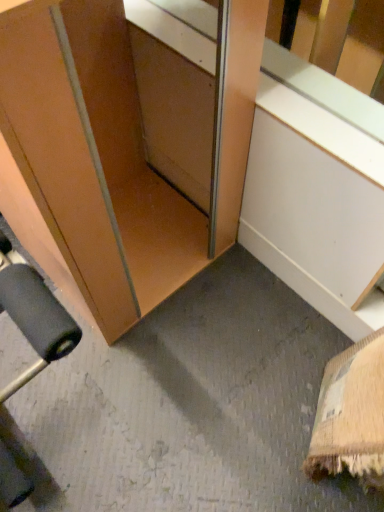
Question: Is matte wood cabinet at lower left shorter than wooden at lower left?

Choices:
 (A) yes
 (B) no

Answer: (B)

Question: Is wooden at lower left surrounded by matte wood cabinet at lower left?

Choices:
 (A) no
 (B) yes

Answer: (A)

Question: Are matte wood cabinet at lower left and wooden at lower left beside each other?

Choices:
 (A) yes
 (B) no

Answer: (B)

Question: From the image's perspective, does matte wood cabinet at lower left appear lower than wooden at lower left?

Choices:
 (A) yes
 (B) no

Answer: (B)

Question: Is matte wood cabinet at lower left at the left side of wooden at lower left?

Choices:
 (A) yes
 (B) no

Answer: (A)

Question: Could you tell me if matte wood cabinet at lower left is turned towards wooden at lower left?

Choices:
 (A) yes
 (B) no

Answer: (B)

Question: Considering the relative sizes of wooden at lower left and matte wood cabinet at lower left in the image provided, is wooden at lower left thinner than matte wood cabinet at lower left?

Choices:
 (A) no
 (B) yes

Answer: (B)

Question: Does wooden at lower left come behind matte wood cabinet at lower left?

Choices:
 (A) no
 (B) yes

Answer: (B)

Question: Considering the relative sizes of wooden at lower left and matte wood cabinet at lower left in the image provided, is wooden at lower left bigger than matte wood cabinet at lower left?

Choices:
 (A) yes
 (B) no

Answer: (B)

Question: Can we say wooden at lower left lies outside matte wood cabinet at lower left?

Choices:
 (A) no
 (B) yes

Answer: (B)

Question: Would you say matte wood cabinet at lower left is part of wooden at lower left's contents?

Choices:
 (A) no
 (B) yes

Answer: (A)

Question: From a real-world perspective, is wooden at lower left positioned over matte wood cabinet at lower left based on gravity?

Choices:
 (A) no
 (B) yes

Answer: (A)

Question: Considering the positions of matte wood cabinet at lower left and wooden at lower left in the image, is matte wood cabinet at lower left wider or thinner than wooden at lower left?

Choices:
 (A) wide
 (B) thin

Answer: (A)